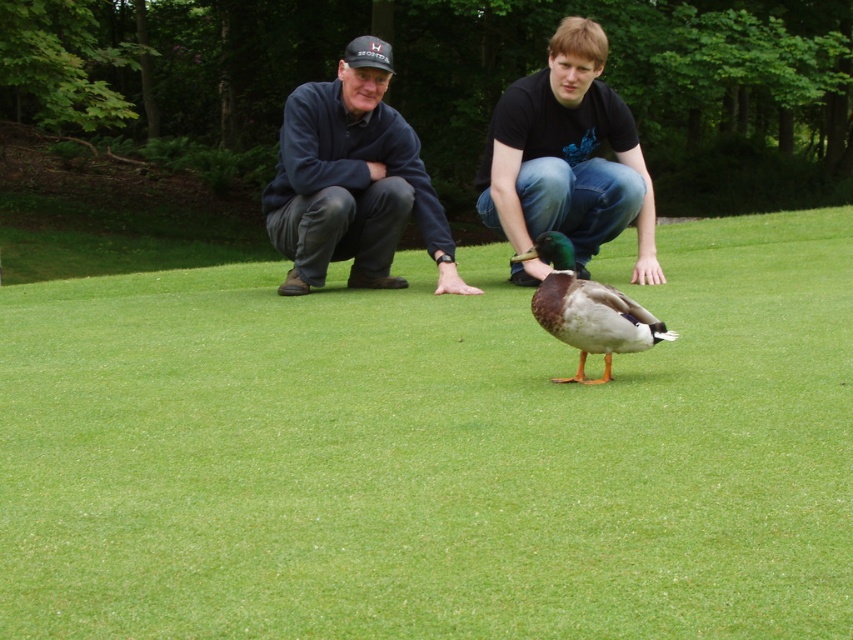
Question: Which object is the closest to the green matte duck at center?

Choices:
 (A) dark blue fleece at center
 (B) green grass at center
 (C) black cotton t-shirt at center

Answer: (B)

Question: Which object is closer to the camera taking this photo?

Choices:
 (A) dark blue fleece at center
 (B) green grass at center
 (C) green matte duck at center

Answer: (C)

Question: Is dark blue fleece at center further to the viewer compared to green matte duck at center?

Choices:
 (A) yes
 (B) no

Answer: (A)

Question: Is black cotton t-shirt at center positioned in front of green matte duck at center?

Choices:
 (A) no
 (B) yes

Answer: (A)

Question: Considering the real-world distances, which object is closest to the green grass at center?

Choices:
 (A) black cotton t-shirt at center
 (B) green matte duck at center

Answer: (B)

Question: Does green grass at center have a lesser width compared to black cotton t-shirt at center?

Choices:
 (A) yes
 (B) no

Answer: (B)